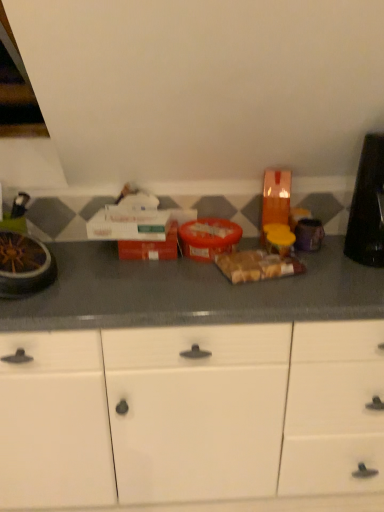
Question: Does metallic silver bowl at left, positioned as the 2th appliance in right-to-left order, touch black plastic toaster at right, the first appliance viewed from the right?

Choices:
 (A) no
 (B) yes

Answer: (A)

Question: Is metallic silver bowl at left, positioned as the first appliance in left-to-right order, oriented towards black plastic toaster at right, the first appliance viewed from the right?

Choices:
 (A) no
 (B) yes

Answer: (A)

Question: Is metallic silver bowl at left, positioned as the 2th appliance in right-to-left order, wider than black plastic toaster at right, which ranks as the 2th appliance in left-to-right order?

Choices:
 (A) yes
 (B) no

Answer: (A)

Question: Are metallic silver bowl at left, positioned as the 2th appliance in right-to-left order, and black plastic toaster at right, which ranks as the 2th appliance in left-to-right order, located far from each other?

Choices:
 (A) yes
 (B) no

Answer: (A)

Question: Is metallic silver bowl at left, positioned as the 2th appliance in right-to-left order, positioned before black plastic toaster at right, the first appliance viewed from the right?

Choices:
 (A) no
 (B) yes

Answer: (B)

Question: Relative to white matte cabinet at center, is black plastic toaster at right, which ranks as the 2th appliance in left-to-right order, in front or behind?

Choices:
 (A) front
 (B) behind

Answer: (B)

Question: Considering the positions of black plastic toaster at right, which ranks as the 2th appliance in left-to-right order, and white matte cabinet at center in the image, is black plastic toaster at right, which ranks as the 2th appliance in left-to-right order, wider or thinner than white matte cabinet at center?

Choices:
 (A) wide
 (B) thin

Answer: (B)

Question: From a real-world perspective, is black plastic toaster at right, the first appliance viewed from the right, above or below white matte cabinet at center?

Choices:
 (A) above
 (B) below

Answer: (A)

Question: Visually, is black plastic toaster at right, the first appliance viewed from the right, positioned to the left or to the right of white matte cabinet at center?

Choices:
 (A) left
 (B) right

Answer: (B)

Question: Is white matte cabinet at center wider or thinner than translucent plastic bag of bread at center?

Choices:
 (A) wide
 (B) thin

Answer: (A)

Question: From the image's perspective, is white matte cabinet at center positioned above or below translucent plastic bag of bread at center?

Choices:
 (A) above
 (B) below

Answer: (B)

Question: From a real-world perspective, relative to translucent plastic bag of bread at center, is white matte cabinet at center vertically above or below?

Choices:
 (A) above
 (B) below

Answer: (B)

Question: Is white matte cabinet at center in front of or behind translucent plastic bag of bread at center in the image?

Choices:
 (A) front
 (B) behind

Answer: (A)

Question: From the image's perspective, relative to black plastic toaster at right, the first appliance viewed from the right, is translucent plastic bag of bread at center above or below?

Choices:
 (A) below
 (B) above

Answer: (A)

Question: Is translucent plastic bag of bread at center in front of or behind black plastic toaster at right, which ranks as the 2th appliance in left-to-right order, in the image?

Choices:
 (A) behind
 (B) front

Answer: (A)